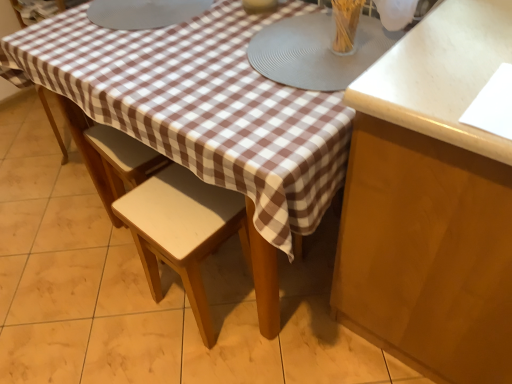
Question: Does clear glass vase at upper center have a larger size compared to matte gray placemat at center, the second round table from the left?

Choices:
 (A) yes
 (B) no

Answer: (B)

Question: Can you confirm if clear glass vase at upper center is shorter than matte gray placemat at center, the second round table from the left?

Choices:
 (A) yes
 (B) no

Answer: (B)

Question: Does clear glass vase at upper center have a smaller size compared to matte gray placemat at center, the second round table from the left?

Choices:
 (A) yes
 (B) no

Answer: (A)

Question: From the image's perspective, is clear glass vase at upper center on top of matte gray placemat at center, which is the 1th round table from right to left?

Choices:
 (A) no
 (B) yes

Answer: (B)

Question: Could matte gray placemat at center, which is the 1th round table from right to left, be considered to be inside clear glass vase at upper center?

Choices:
 (A) yes
 (B) no

Answer: (B)

Question: Would you say light beige wood stool at center is inside or outside matte brown cabinet at right?

Choices:
 (A) inside
 (B) outside

Answer: (B)

Question: Is point (158, 218) positioned closer to the camera than point (419, 256)?

Choices:
 (A) farther
 (B) closer

Answer: (A)

Question: Is light beige wood stool at center taller or shorter than matte brown cabinet at right?

Choices:
 (A) short
 (B) tall

Answer: (A)

Question: From a real-world perspective, is light beige wood stool at center above or below matte brown cabinet at right?

Choices:
 (A) below
 (B) above

Answer: (A)

Question: From the image's perspective, is matte gray placemat at center, which is the 1th round table from right to left, above or below clear glass vase at upper center?

Choices:
 (A) above
 (B) below

Answer: (B)

Question: Which is correct: matte gray placemat at center, the second round table from the left, is inside clear glass vase at upper center, or outside of it?

Choices:
 (A) outside
 (B) inside

Answer: (A)

Question: Considering the positions of matte gray placemat at center, the second round table from the left, and clear glass vase at upper center in the image, is matte gray placemat at center, the second round table from the left, bigger or smaller than clear glass vase at upper center?

Choices:
 (A) big
 (B) small

Answer: (A)

Question: From their relative heights in the image, would you say matte gray placemat at center, which is the 1th round table from right to left, is taller or shorter than clear glass vase at upper center?

Choices:
 (A) tall
 (B) short

Answer: (B)

Question: Is matte brown cabinet at right to the left or to the right of clear glass vase at upper center in the image?

Choices:
 (A) left
 (B) right

Answer: (B)

Question: From the image's perspective, relative to clear glass vase at upper center, is matte brown cabinet at right above or below?

Choices:
 (A) below
 (B) above

Answer: (A)